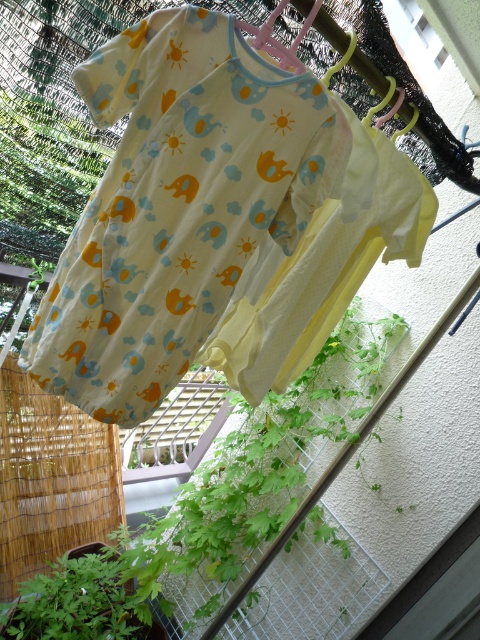
You are a parent trying to hang a new baby onesie on the clothesline. The onesie you want to hang is 37.24 inches away from the camera. If the existing matte yellow fabric baby clothes at center is already occupying that space, can you hang your new onesie there?

The matte yellow fabric baby clothes at center is already 37.24 inches from the camera, so there is no space to hang the new onesie there.

You are a parent trying to decide whether to put the matte yellow fabric baby clothes at center and the green leafy plant at lower left in a storage box. The box can only hold items that are closer to you. Which item should you choose?

The matte yellow fabric baby clothes at center is closer to the viewer than the green leafy plant at lower left, so you should choose the matte yellow fabric baby clothes at center for storage.

You are a parent trying to decide if the matte yellow fabric baby clothes at center will fit in a drawer next to the green leafy plant at lower left. Based on their sizes, which object is wider?

The matte yellow fabric baby clothes at center is wider than the green leafy plant at lower left.